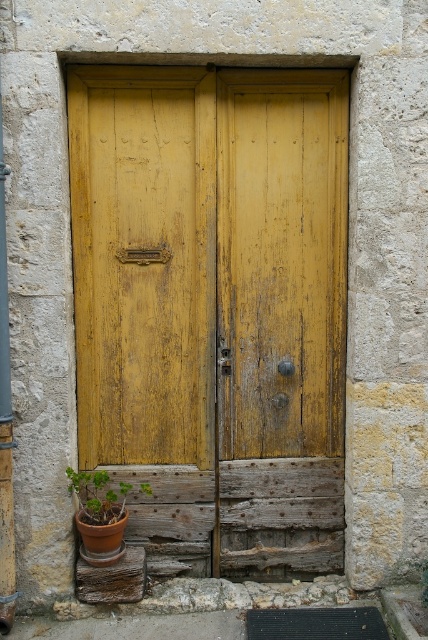
Does yellow wood door at center appear under green matte pot at lower left?

Incorrect, yellow wood door at center is not positioned below green matte pot at lower left.

Which is in front, point (193, 385) or point (139, 486)?

Point (193, 385) is more forward.

The width and height of the screenshot is (428, 640). Find the location of `yellow wood door at center`. yellow wood door at center is located at coordinates (214, 305).